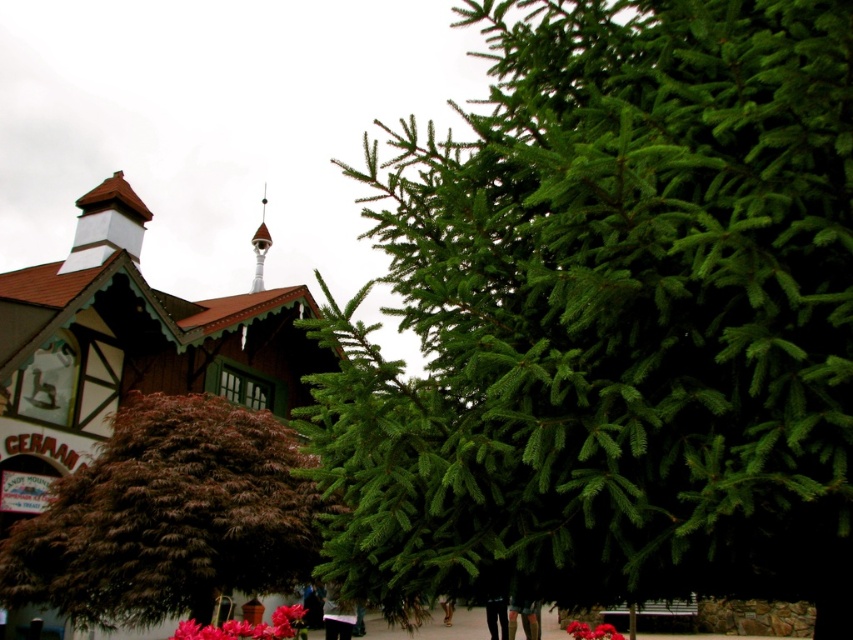
This screenshot has height=640, width=853. What do you see at coordinates (169, 516) in the screenshot? I see `dark red glossy tree at center` at bounding box center [169, 516].

The width and height of the screenshot is (853, 640). I want to click on dark red glossy tree at center, so click(x=169, y=516).

Does green needle-like at right have a greater height compared to vivid pink petals at center?

Indeed, green needle-like at right has a greater height compared to vivid pink petals at center.

Is green needle-like at right closer to the viewer compared to vivid pink petals at center?

Yes.

Does point (747, 147) lie behind point (572, 628)?

No, it is not.

You are a GUI agent. You are given a task and a screenshot of the screen. Output one action in this format:
    pyautogui.click(x=<x>, y=<y>)
    Task: Click on the green needle-like at right
    The height and width of the screenshot is (640, 853).
    Given the screenshot: What is the action you would take?
    pyautogui.click(x=611, y=317)

Does dark red glossy tree at center have a greater height compared to white wood spire at upper center?

In fact, dark red glossy tree at center may be shorter than white wood spire at upper center.

Which is more to the left, dark red glossy tree at center or white wood spire at upper center?

Positioned to the left is white wood spire at upper center.

Is point (61, 579) more distant than point (254, 243)?

No.

The height and width of the screenshot is (640, 853). I want to click on dark red glossy tree at center, so click(x=169, y=516).